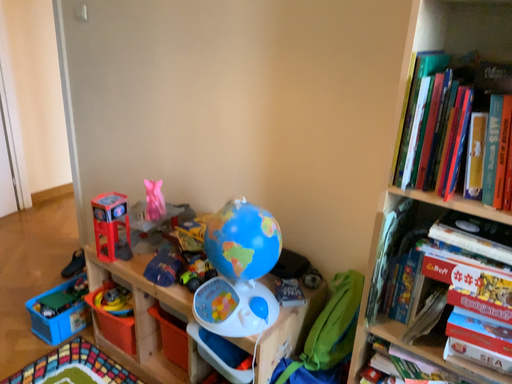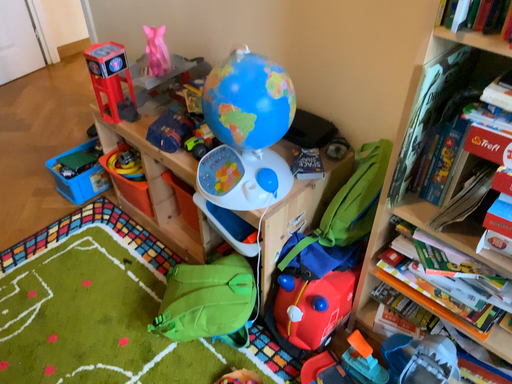
Question: Which way did the camera rotate in the video?

Choices:
 (A) rotated downward
 (B) rotated upward

Answer: (A)